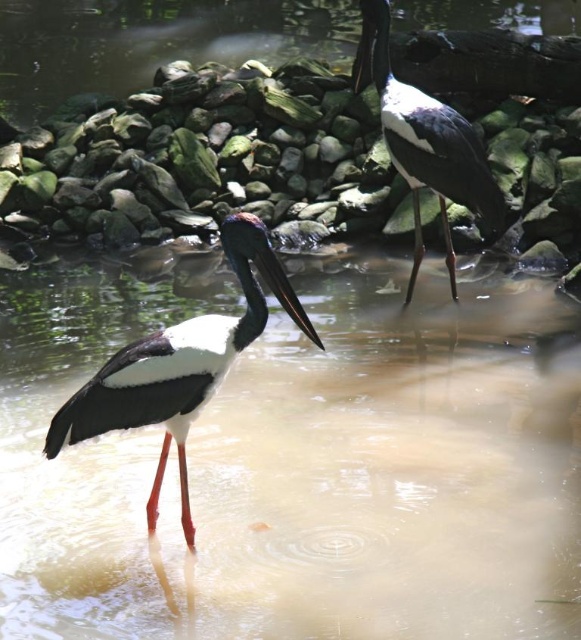
Which of these two, black glossy stork at center or black glossy stork at upper right, stands shorter?

With less height is black glossy stork at center.

The image size is (581, 640). Identify the location of black glossy stork at center. point(180,364).

Locate an element on the screen. Image resolution: width=581 pixels, height=640 pixels. black glossy stork at center is located at coordinates (180, 364).

Is translucent muddy water at center wider than black glossy stork at upper right?

Yes, translucent muddy water at center is wider than black glossy stork at upper right.

Locate an element on the screen. The image size is (581, 640). translucent muddy water at center is located at coordinates (302, 467).

Who is positioned more to the left, translucent muddy water at center or black glossy stork at center?

translucent muddy water at center

Who is more forward, (417, 403) or (214, 342)?

Point (214, 342)

Image resolution: width=581 pixels, height=640 pixels. Identify the location of translucent muddy water at center. (302, 467).